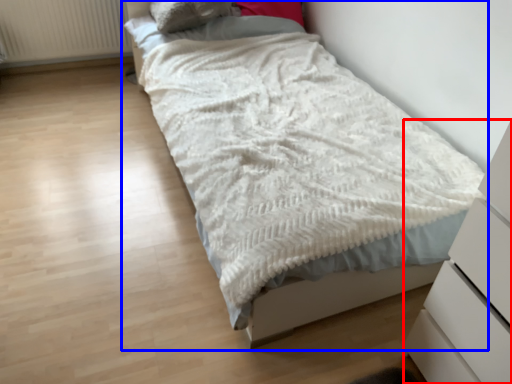
Question: Among these objects, which one is nearest to the camera, chest of drawers (highlighted by a red box) or bed (highlighted by a blue box)?

Choices:
 (A) chest of drawers
 (B) bed

Answer: (A)